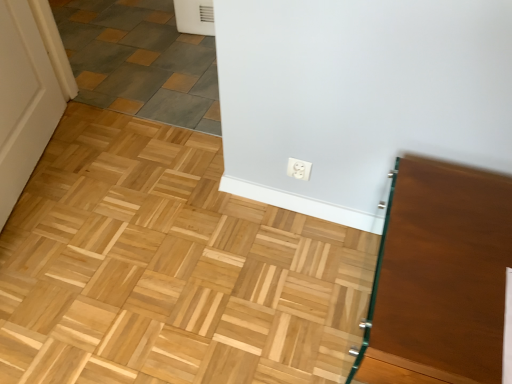
Question: Can you confirm if gray slate tile at upper left is wider than white plastic outlet at center?

Choices:
 (A) yes
 (B) no

Answer: (A)

Question: Is the depth of gray slate tile at upper left less than that of white plastic outlet at center?

Choices:
 (A) yes
 (B) no

Answer: (B)

Question: From the image's perspective, is gray slate tile at upper left beneath white plastic outlet at center?

Choices:
 (A) no
 (B) yes

Answer: (A)

Question: From a real-world perspective, is gray slate tile at upper left under white plastic outlet at center?

Choices:
 (A) no
 (B) yes

Answer: (B)

Question: Can we say gray slate tile at upper left lies outside white plastic outlet at center?

Choices:
 (A) no
 (B) yes

Answer: (B)

Question: Considering their positions, is gray slate tile at upper left located in front of or behind white plastic outlet at center?

Choices:
 (A) front
 (B) behind

Answer: (B)

Question: From a real-world perspective, is gray slate tile at upper left above or below white plastic outlet at center?

Choices:
 (A) above
 (B) below

Answer: (B)

Question: Would you say gray slate tile at upper left is to the left or to the right of white plastic outlet at center in the picture?

Choices:
 (A) left
 (B) right

Answer: (A)

Question: Based on their sizes in the image, would you say gray slate tile at upper left is bigger or smaller than white plastic outlet at center?

Choices:
 (A) small
 (B) big

Answer: (B)

Question: From the image's perspective, relative to gray slate tile at upper left, is white plastic outlet at center above or below?

Choices:
 (A) above
 (B) below

Answer: (B)

Question: Considering the positions of white plastic outlet at center and gray slate tile at upper left in the image, is white plastic outlet at center bigger or smaller than gray slate tile at upper left?

Choices:
 (A) big
 (B) small

Answer: (B)

Question: Would you say white plastic outlet at center is inside or outside gray slate tile at upper left?

Choices:
 (A) inside
 (B) outside

Answer: (B)

Question: From a real-world perspective, is white plastic outlet at center above or below gray slate tile at upper left?

Choices:
 (A) above
 (B) below

Answer: (A)

Question: Is point pyautogui.click(x=70, y=57) closer or farther from the camera than point pyautogui.click(x=468, y=225)?

Choices:
 (A) farther
 (B) closer

Answer: (A)

Question: In the image, is gray slate tile at upper left on the left side or the right side of brown glossy vanity at right?

Choices:
 (A) left
 (B) right

Answer: (A)